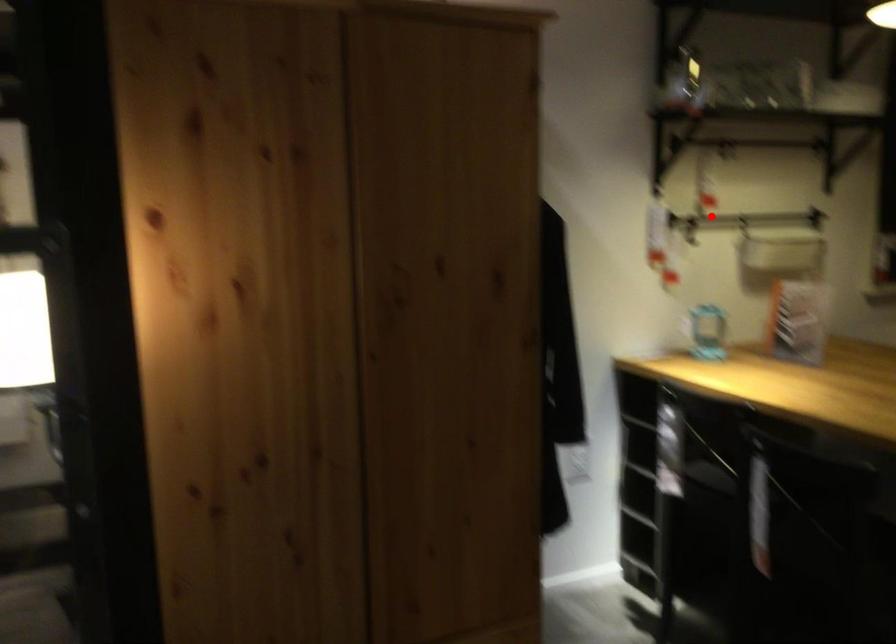
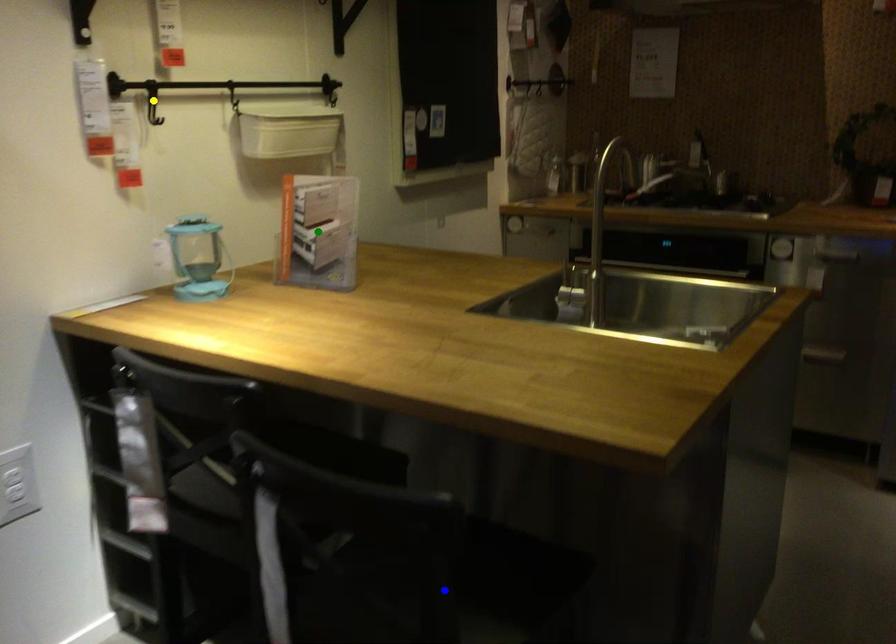
Question: I am providing you with two images of the same scene from different viewpoints. A red point is marked on the first image. You are given multiple points on the second image. In image 2, which mark is for the same physical point as the one in image 1?

Choices:
 (A) blue point
 (B) green point
 (C) yellow point

Answer: (C)